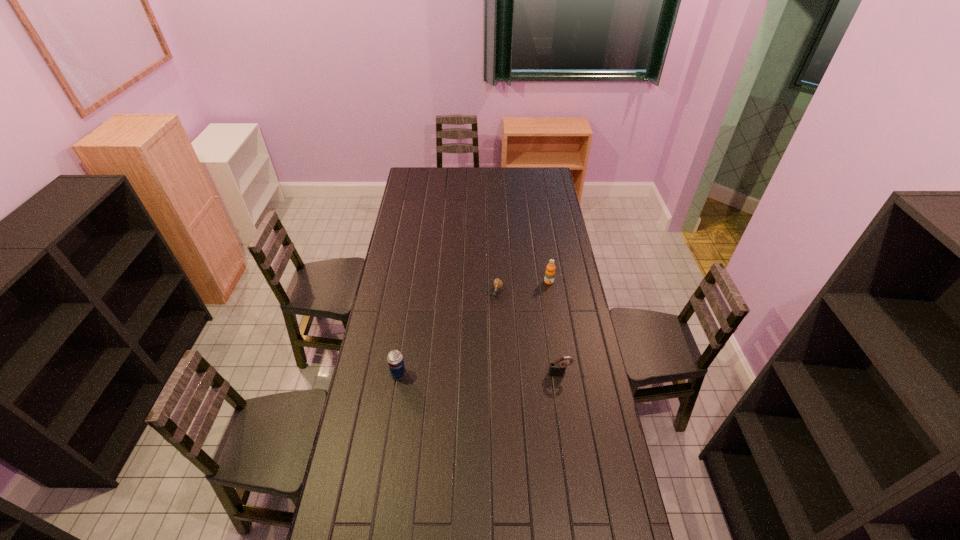
Find the location of a particular element. beer can is located at coordinates (395, 360).

What are the coordinates of `padlock` in the screenshot? It's located at (557, 368).

The image size is (960, 540). In order to click on orange juice in this screenshot , I will do `click(550, 268)`.

Where is `the shortest object`? This screenshot has height=540, width=960. the shortest object is located at coordinates (498, 284).

The image size is (960, 540). Find the location of `escargot`. escargot is located at coordinates (498, 284).

This screenshot has height=540, width=960. I want to click on free region located on the front of the beer can, so click(381, 486).

Find the location of `blank area located 0.340m with the keyhole on the front of the padlock`. blank area located 0.340m with the keyhole on the front of the padlock is located at coordinates (573, 462).

Locate an element on the screen. free region located 0.070m on the label of the orange juice is located at coordinates 542,294.

This screenshot has height=540, width=960. In order to click on free space located on the label of the orange juice in this screenshot , I will do `click(516, 341)`.

The height and width of the screenshot is (540, 960). What are the coordinates of `free spot located on the label of the orange juice` in the screenshot? It's located at (538, 302).